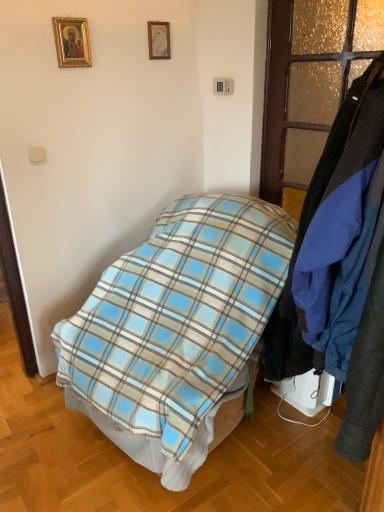
Question: Which is correct: matte gold picture frame at upper center, which appears as the first picture frame when viewed from the back, is inside gold-framed picture at upper left, which ranks as the second picture frame in back-to-front order, or outside of it?

Choices:
 (A) outside
 (B) inside

Answer: (A)

Question: From a real-world perspective, is matte gold picture frame at upper center, which appears as the first picture frame when viewed from the back, above or below gold-framed picture at upper left, which ranks as the 1th picture frame in front-to-back order?

Choices:
 (A) below
 (B) above

Answer: (B)

Question: Which object is the farthest from the blue fabric coat at right?

Choices:
 (A) blue plaid blanket at center
 (B) textured gold glass door at right
 (C) gold-framed picture at upper left, which ranks as the second picture frame in back-to-front order
 (D) matte gold picture frame at upper center, marked as the first picture frame in a right-to-left arrangement

Answer: (D)

Question: Which of these objects is positioned farthest from the gold-framed picture at upper left, which ranks as the second picture frame in back-to-front order?

Choices:
 (A) matte gold picture frame at upper center, which is the 2th picture frame from left to right
 (B) blue plaid blanket at center
 (C) textured gold glass door at right
 (D) blue fabric coat at right

Answer: (D)